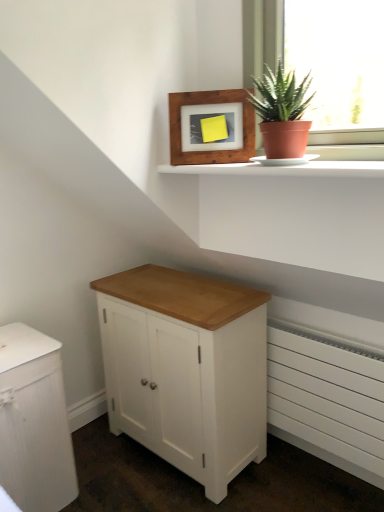
Locate an element on the screen. The image size is (384, 512). vacant region above white matte radiator at lower right (from a real-world perspective) is located at coordinates (307, 332).